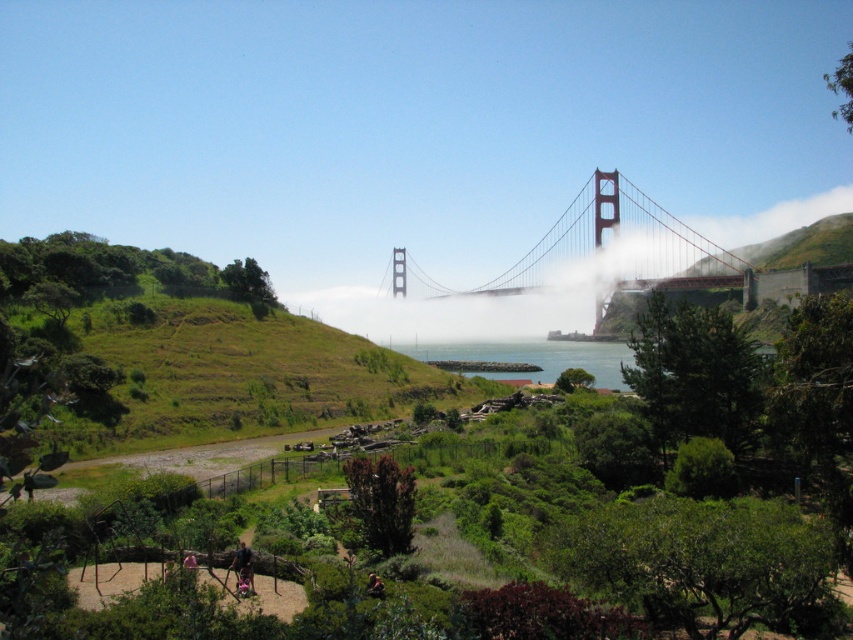
Looking at this image, which is more to the left, red painted steel suspension bridge at center or clear blue water at center?

clear blue water at center is more to the left.

Who is shorter, red painted steel suspension bridge at center or clear blue water at center?

clear blue water at center is shorter.

Find the location of `red painted steel suspension bridge at center`. red painted steel suspension bridge at center is located at coordinates 604,248.

The width and height of the screenshot is (853, 640). Find the location of `red painted steel suspension bridge at center`. red painted steel suspension bridge at center is located at coordinates (604, 248).